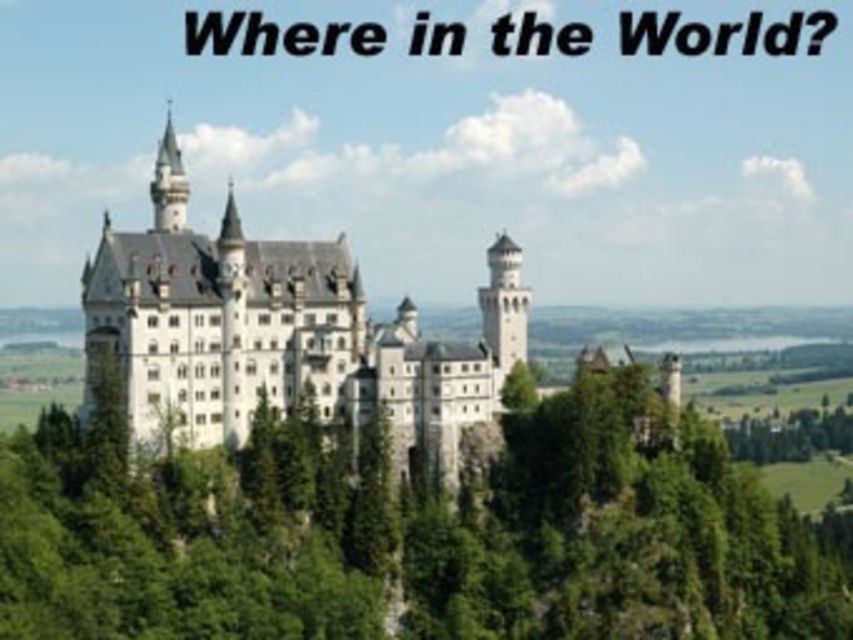
You are standing in front of the castle and want to take a photo. You notice two points marked on the image at coordinates point (103, 426) and point (498, 252). Which point is closer to your current position?

Point (103, 426) is closer to the camera than point (498, 252), so it is closer to your current position.

You are standing at the base of the white stone castle at center and want to plant a new tree that needs to be at least 15 meters away from any structure to grow properly. Can you plant the new tree where the green leafy tree at center is currently located?

The green leafy tree at center is only 13.65 meters from the white stone castle at center, which is less than the required 15 meters. Therefore, you cannot plant the new tree there as it does not meet the distance requirement.

You are a visitor standing at the base of the hill looking up at the castle. Which object, the green leafy tree at center or the white stone castle at center, would appear taller from your perspective?

The white stone castle at center appears taller than the green leafy tree at center from your perspective since the castle is taller according to the description.